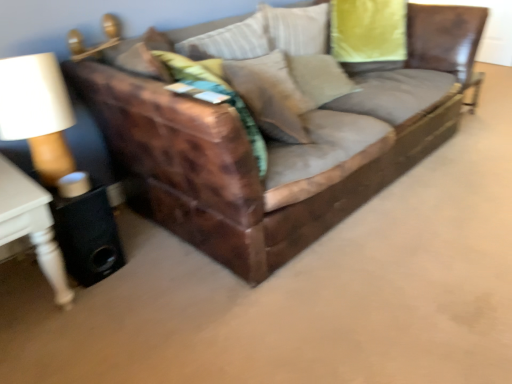
The width and height of the screenshot is (512, 384). I want to click on leather couch at center, so (282, 146).

Is suede-like beige pillow at center completely or partially outside of leather couch at center?

No, suede-like beige pillow at center is not outside of leather couch at center.

Does suede-like beige pillow at center turn towards leather couch at center?

Yes, suede-like beige pillow at center is aimed at leather couch at center.

Between white wood side table at left and suede-like beige pillow at center, which one appears on the left side from the viewer's perspective?

white wood side table at left.

Would you say white wood side table at left is inside or outside suede-like beige pillow at center?

white wood side table at left exists outside the volume of suede-like beige pillow at center.

Is the position of white wood side table at left more distant than that of suede-like beige pillow at center?

No, white wood side table at left is in front of suede-like beige pillow at center.

Which of these two, white wood side table at left or suede-like beige pillow at center, is smaller?

Smaller between the two is suede-like beige pillow at center.

Who is taller, suede-like beige pillow at center or white wood side table at left?

With more height is white wood side table at left.

Between suede-like beige pillow at center and white wood side table at left, which one has larger width?

white wood side table at left is wider.

Considering the points (265, 72) and (42, 199), which point is behind, point (265, 72) or point (42, 199)?

Point (265, 72)

Between suede-like beige pillow at center and white wood side table at left, which one has smaller size?

suede-like beige pillow at center.

Can you confirm if leather couch at center is taller than suede-like beige pillow at center?

Indeed, leather couch at center has a greater height compared to suede-like beige pillow at center.

Would you say leather couch at center is outside suede-like beige pillow at center?

Indeed, leather couch at center is completely outside suede-like beige pillow at center.

Does leather couch at center have a larger size compared to suede-like beige pillow at center?

Result: Correct, leather couch at center is larger in size than suede-like beige pillow at center.

Which object is positioned more to the left, leather couch at center or white wood side table at left?

white wood side table at left.

Which of these two, leather couch at center or white wood side table at left, is bigger?

leather couch at center.

Between leather couch at center and white wood side table at left, which one has larger width?

With larger width is leather couch at center.

Image resolution: width=512 pixels, height=384 pixels. I want to click on studio couch above the white wood side table at left (from a real-world perspective), so click(282, 146).

What's the angular difference between white wood side table at left and leather couch at center's facing directions?

0.00257 degrees separate the facing orientations of white wood side table at left and leather couch at center.

Is white wood side table at left inside the boundaries of leather couch at center, or outside?

white wood side table at left is outside leather couch at center.

Identify the location of pillow above the leather couch at center (from a real-world perspective). Image resolution: width=512 pixels, height=384 pixels. (269, 95).

Find the location of a particular element. table that is on the left side of suede-like beige pillow at center is located at coordinates (32, 225).

Looking at the image, which one is located closer to suede-like beige pillow at center, leather couch at center or white wood side table at left?

Among the two, leather couch at center is located nearer to suede-like beige pillow at center.

Looking at the image, which one is located further to leather couch at center, suede-like beige pillow at center or white wood side table at left?

white wood side table at left is positioned further to the anchor leather couch at center.

Looking at the image, which one is located further to leather couch at center, white wood side table at left or suede-like beige pillow at center?

white wood side table at left lies further to leather couch at center than the other object.

From the image, which object appears to be farther from white wood side table at left, leather couch at center or suede-like beige pillow at center?

The object further to white wood side table at left is suede-like beige pillow at center.

From the image, which object appears to be farther from white wood side table at left, suede-like beige pillow at center or leather couch at center?

The object further to white wood side table at left is suede-like beige pillow at center.

Based on their spatial positions, is white wood side table at left or leather couch at center further from suede-like beige pillow at center?

white wood side table at left lies further to suede-like beige pillow at center than the other object.

I want to click on pillow between white wood side table at left and leather couch at center from left to right, so click(x=269, y=95).